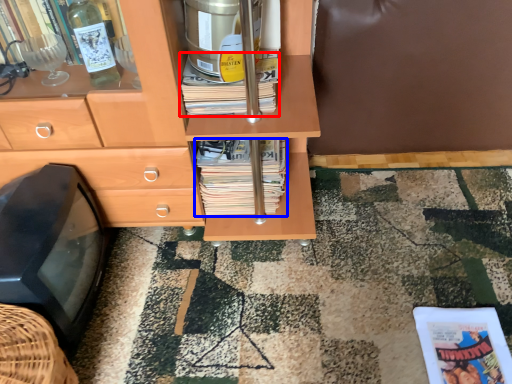
Question: Which of the following is the farthest to the observer, book (highlighted by a red box) or magazine (highlighted by a blue box)?

Choices:
 (A) book
 (B) magazine

Answer: (B)